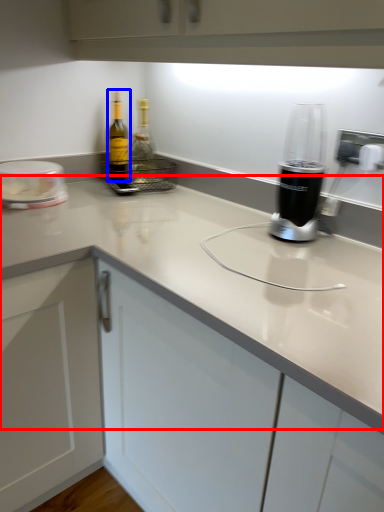
Question: Which object is closer to the camera taking this photo, counter top (highlighted by a red box) or bottle (highlighted by a blue box)?

Choices:
 (A) counter top
 (B) bottle

Answer: (A)